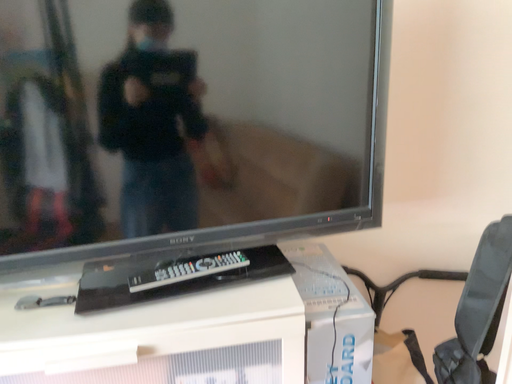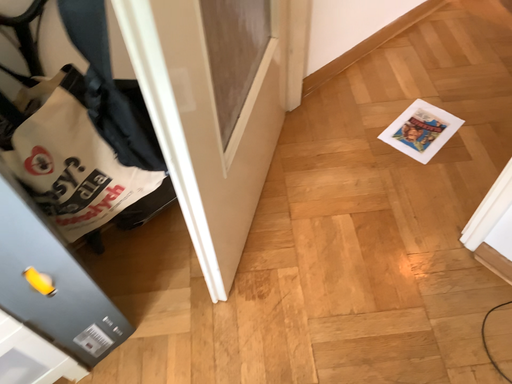
Question: Which way did the camera rotate in the video?

Choices:
 (A) rotated left
 (B) rotated right

Answer: (B)